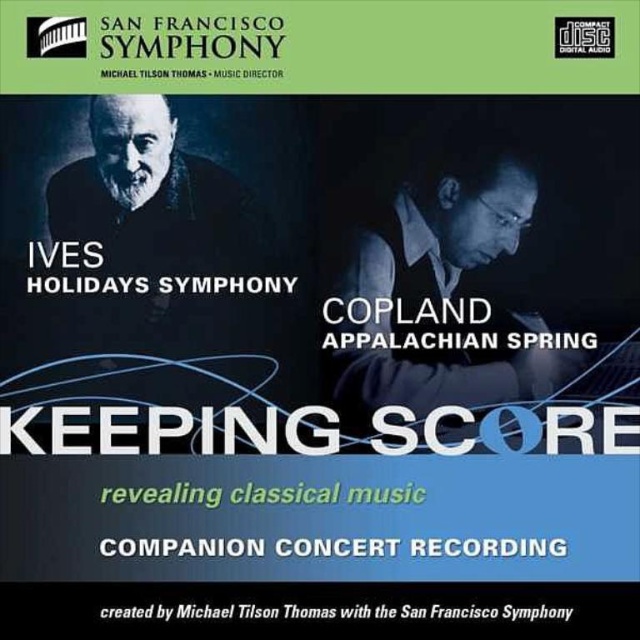
Does green matte text at center appear on the right side of black text at upper center?

Correct, you'll find green matte text at center to the right of black text at upper center.

Is green matte text at center thinner than black text at upper center?

Incorrect, green matte text at center's width is not less than black text at upper center's.

Describe the element at coordinates (163, 493) in the screenshot. I see `green matte text at center` at that location.

Locate an element on the screen. green matte text at center is located at coordinates (163, 493).

Which is behind, point (68, 284) or point (132, 614)?

Point (68, 284)

Does point (196, 273) come in front of point (225, 618)?

That is False.

Locate an element on the screen. This screenshot has width=640, height=640. white paper text at upper center is located at coordinates (77, 269).

Looking at this image, can you confirm if whitetextcompanion concert recording at center is wider than black text at bottom?

In fact, whitetextcompanion concert recording at center might be narrower than black text at bottom.

Does whitetextcompanion concert recording at center appear on the right side of black text at bottom?

Correct, you'll find whitetextcompanion concert recording at center to the right of black text at bottom.

Does point (106, 554) come closer to viewer compared to point (195, 604)?

Yes, point (106, 554) is closer to viewer.

Locate an element on the screen. The height and width of the screenshot is (640, 640). whitetextcompanion concert recording at center is located at coordinates (180, 547).